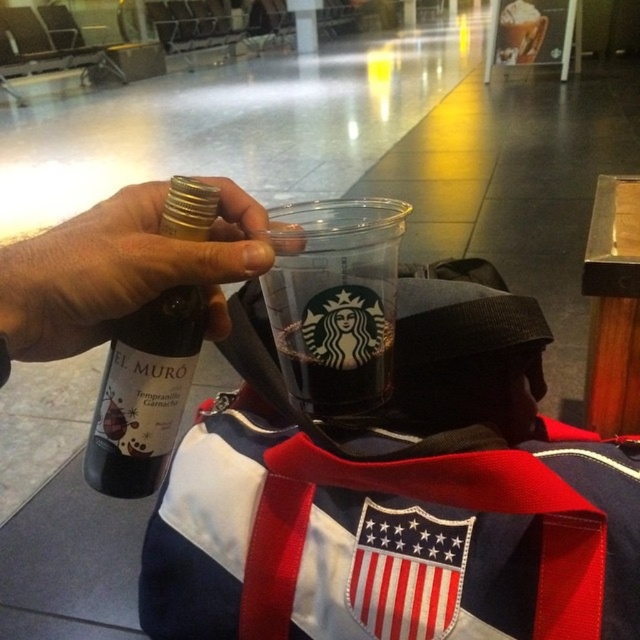
Question: Which of the following is the farthest from the observer?

Choices:
 (A) transparent plastic cup at center
 (B) red and white canvas bag at center

Answer: (A)

Question: Among these points, which one is farthest from the camera?

Choices:
 (A) pos(340,285)
 (B) pos(520,324)

Answer: (B)

Question: Based on their relative distances, which object is nearer to the red and white canvas bag at center?

Choices:
 (A) matte black bottle at upper left
 (B) transparent plastic cup at center
 (C) matte glass bottle at upper left

Answer: (B)

Question: From the image, what is the correct spatial relationship of red and white canvas bag at center in relation to transparent plastic cup at center?

Choices:
 (A) above
 (B) below

Answer: (B)

Question: Considering the relative positions of matte black bottle at upper left and transparent plastic cup at center in the image provided, where is matte black bottle at upper left located with respect to transparent plastic cup at center?

Choices:
 (A) below
 (B) above

Answer: (B)

Question: Is red and white canvas bag at center bigger than matte black bottle at upper left?

Choices:
 (A) yes
 (B) no

Answer: (A)